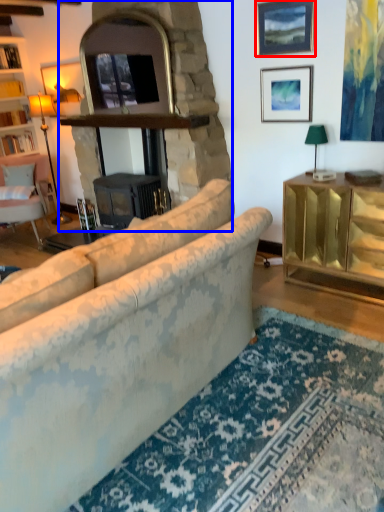
Question: Which point is closer to the camera, picture frame (highlighted by a red box) or fireplace (highlighted by a blue box)?

Choices:
 (A) picture frame
 (B) fireplace

Answer: (B)